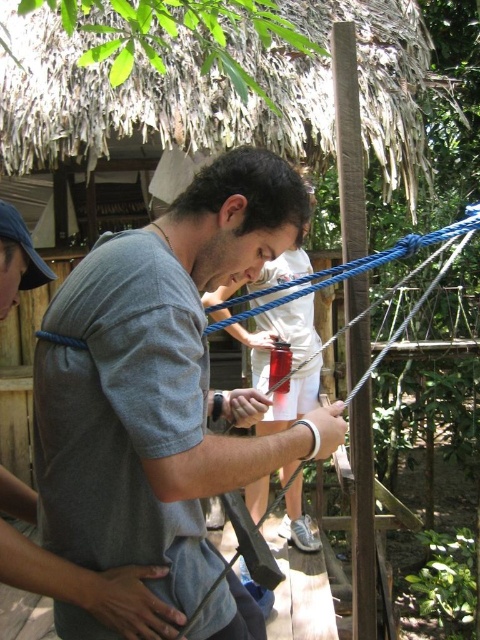
What do you see at coordinates (162, 380) in the screenshot? I see `gray matte shirt at center` at bounding box center [162, 380].

Which is more to the left, gray matte shirt at center or matte gray shirt at center?

gray matte shirt at center is more to the left.

Between point (218, 616) and point (282, 403), which one is positioned in front?

Positioned in front is point (218, 616).

This screenshot has height=640, width=480. I want to click on gray matte shirt at center, so click(162, 380).